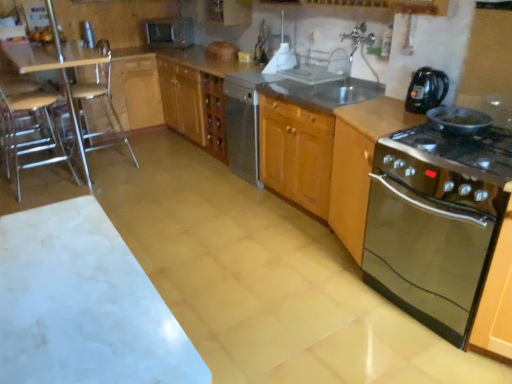
Find the location of `vacant space in white glossy sink at center (from a real-world perspective)`. vacant space in white glossy sink at center (from a real-world perspective) is located at coordinates (311, 79).